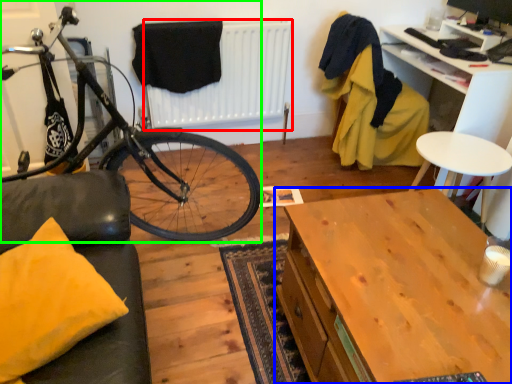
Question: Based on their relative distances, which object is farther from radiator (highlighted by a red box)? Choose from desk (highlighted by a blue box) and bicycle (highlighted by a green box).

Choices:
 (A) desk
 (B) bicycle

Answer: (A)